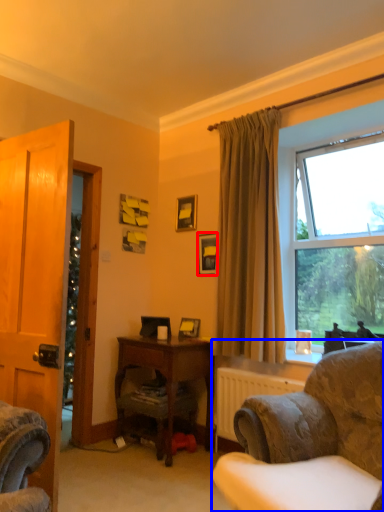
Question: Which object is further to the camera taking this photo, picture frame (highlighted by a red box) or chair (highlighted by a blue box)?

Choices:
 (A) picture frame
 (B) chair

Answer: (A)